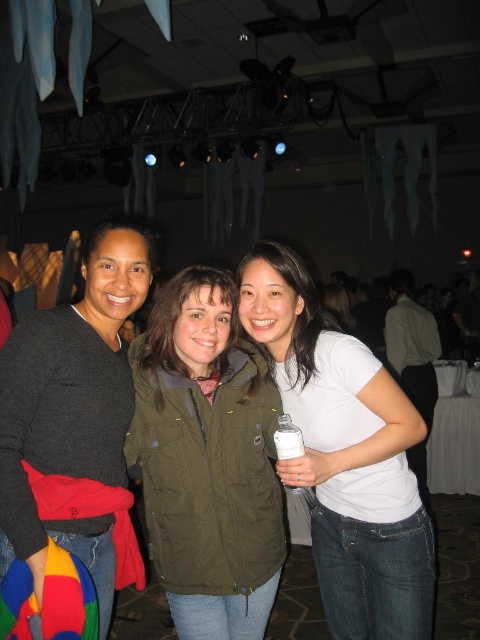
Question: Is the position of white matte shirt at center less distant than that of dark gray sweater at center?

Choices:
 (A) no
 (B) yes

Answer: (A)

Question: Which point is closer to the camera?

Choices:
 (A) (265, 476)
 (B) (290, 358)

Answer: (A)

Question: Can you confirm if olive green jacket at center is thinner than white matte shirt at center?

Choices:
 (A) no
 (B) yes

Answer: (B)

Question: In this image, where is olive green jacket at center located relative to dark gray sweater at center?

Choices:
 (A) above
 (B) below

Answer: (B)

Question: Among these points, which one is farthest from the camera?

Choices:
 (A) (228, 330)
 (B) (28, 486)
 (C) (384, 410)

Answer: (A)

Question: Which of the following is the farthest from the observer?

Choices:
 (A) (171, 442)
 (B) (432, 545)

Answer: (B)